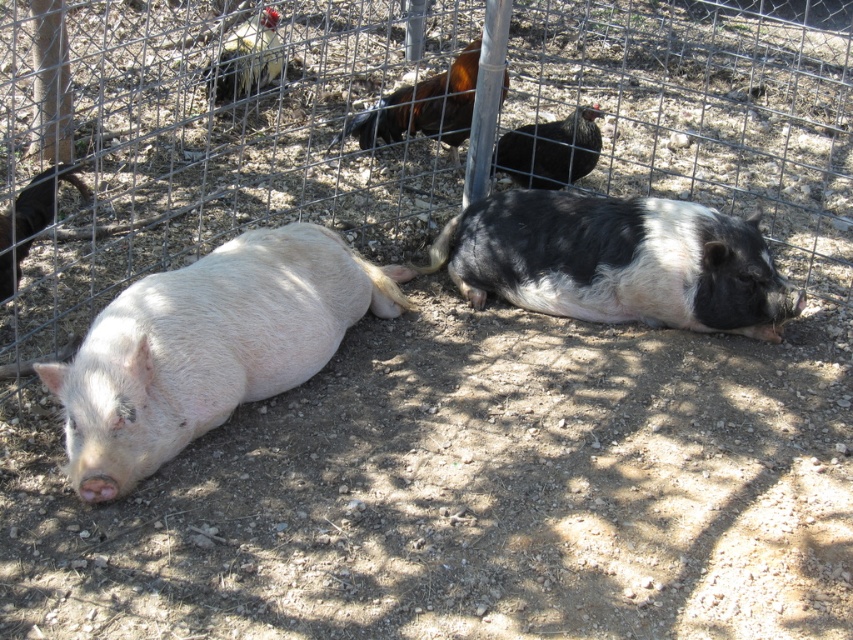
Based on the photo, which is above, matte pink pig at left or black and white fur at center?

black and white fur at center

Who is more distant from viewer, (366, 288) or (457, 252)?

Point (457, 252)

You are a GUI agent. You are given a task and a screenshot of the screen. Output one action in this format:
    pyautogui.click(x=<x>, y=<y>)
    Task: Click on the matte pink pig at left
    
    Given the screenshot: What is the action you would take?
    pyautogui.click(x=207, y=346)